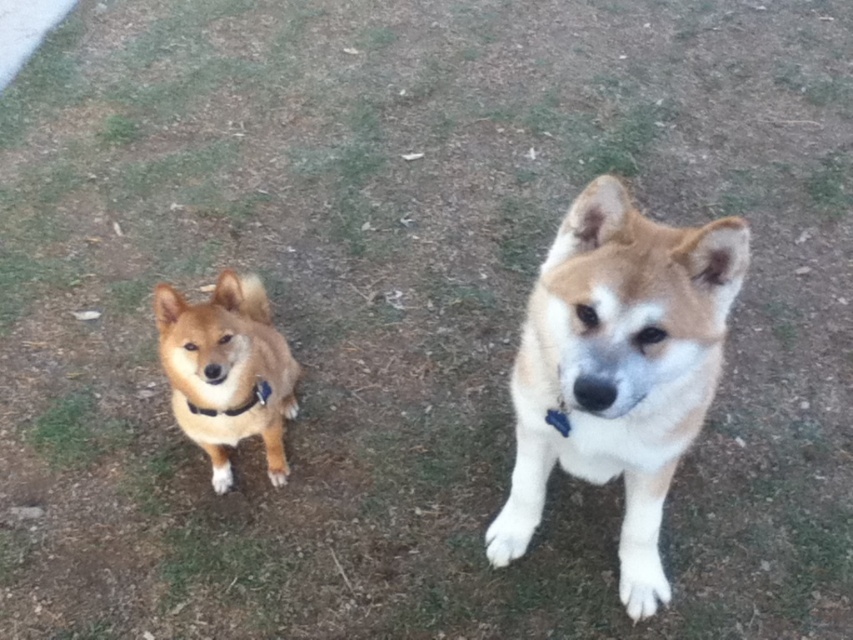
Consider the image. Based on the coordinates provided, can you determine the position of the light brown fur dog at center relative to the image frame?

The light brown fur dog at center is located at the coordinates 0.577 on the x axis and 0.726 on the y axis within the image frame.